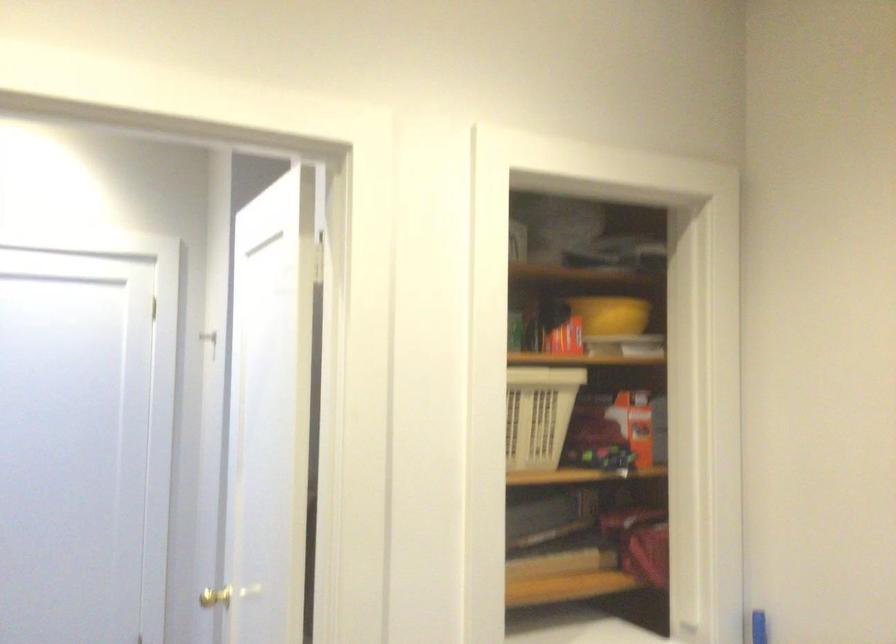
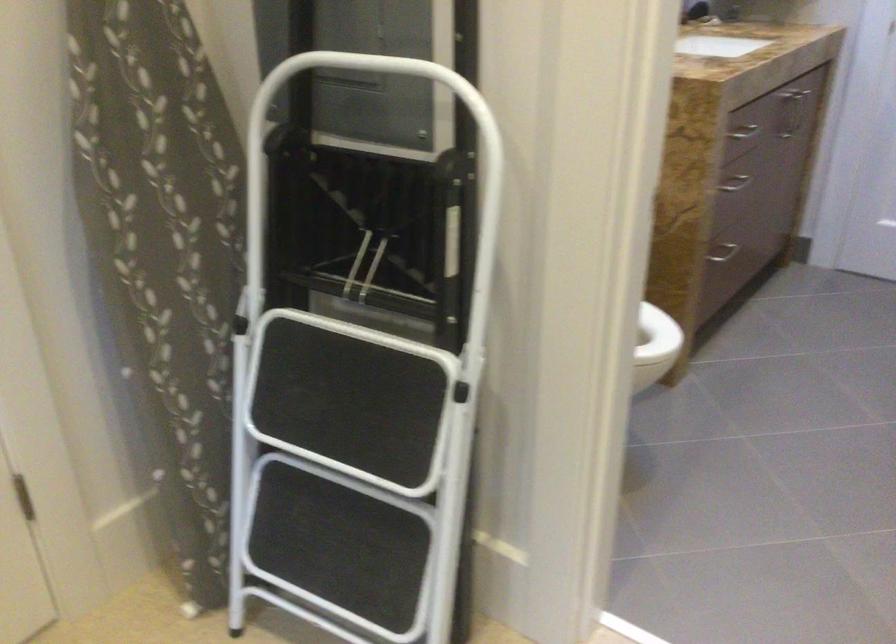
Based on the continuous images, in which direction is the camera rotating?

The rotation direction of the camera is left-down.